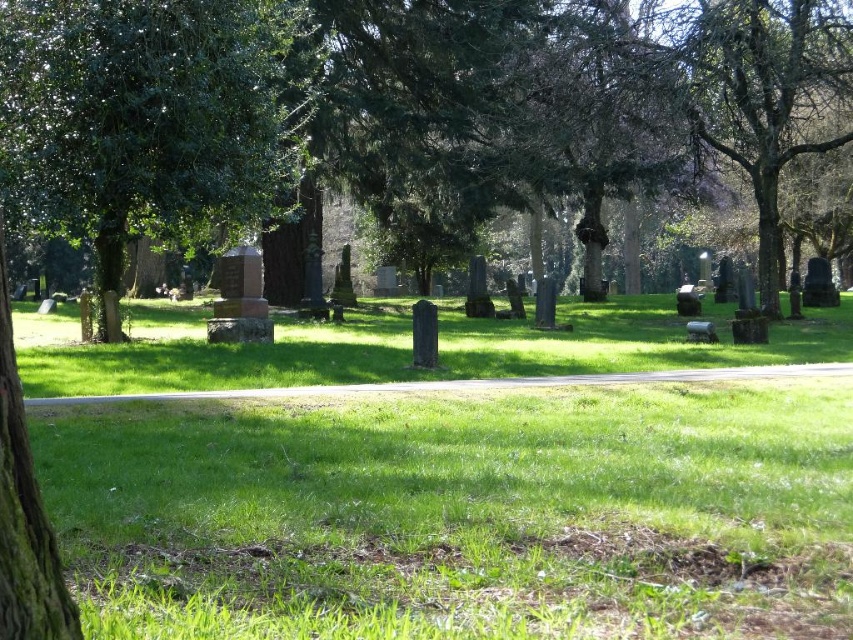
You are standing in the cemetery and want to walk directly towards the green leafy tree at center. Which direction should you head relative to the green leafy tree at left?

You should head to the right of the green leafy tree at left because the green leafy tree at center is positioned to the right of it.